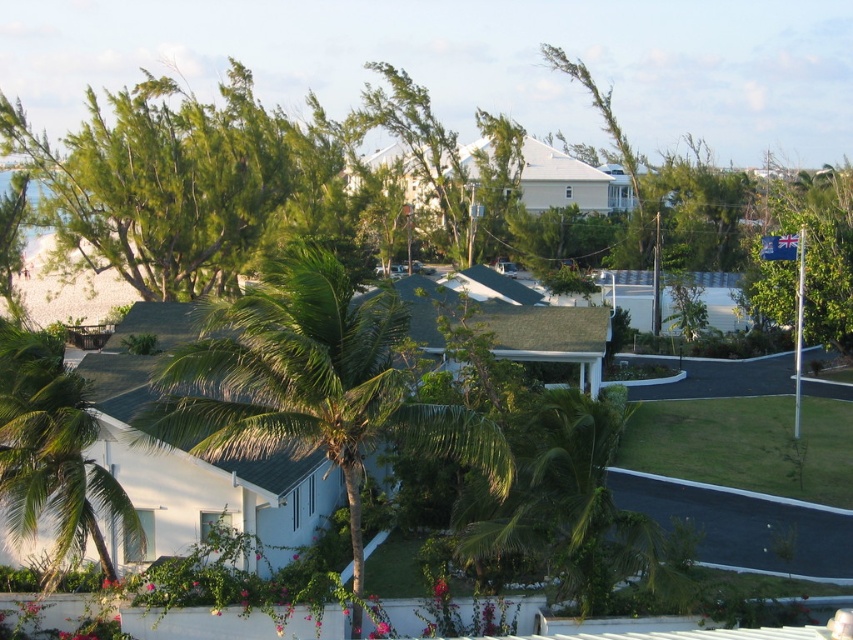
You are standing in the front yard of the white house and want to walk towards the green leafy palm tree at center. Which direction should you walk relative to the green leafy palm tree at lower left?

You should walk to the right relative to the green leafy palm tree at lower left because the green leafy palm tree at center is positioned on the right side of it.

In the scene shown: You are planning to plant a new palm tree in your yard. You have two options based on the image. Which palm tree, the green leafy palm tree at center or the green leafy palm tree at lower left, would you choose if you want a wider tree for shade?

The green leafy palm tree at center has a larger width than the green leafy palm tree at lower left, so it would be the better choice for a wider tree providing more shade.

You are a bird looking for a higher perch. Given the two green leafy palm trees in the image, which one should you choose between the green leafy palm tree at center and the green leafy palm tree at lower left?

The green leafy palm tree at center is much taller than the green leafy palm tree at lower left, so you should choose the green leafy palm tree at center for a higher perch.